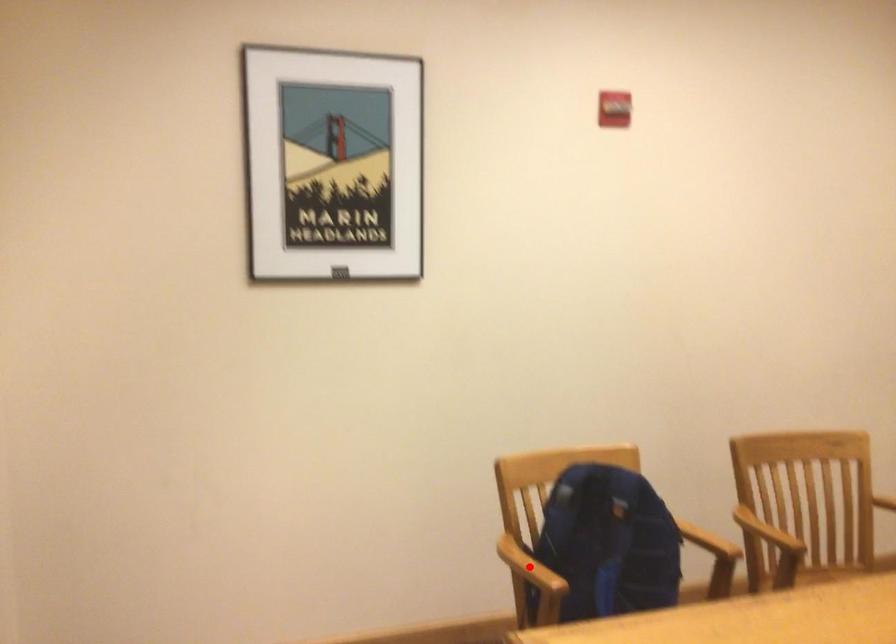
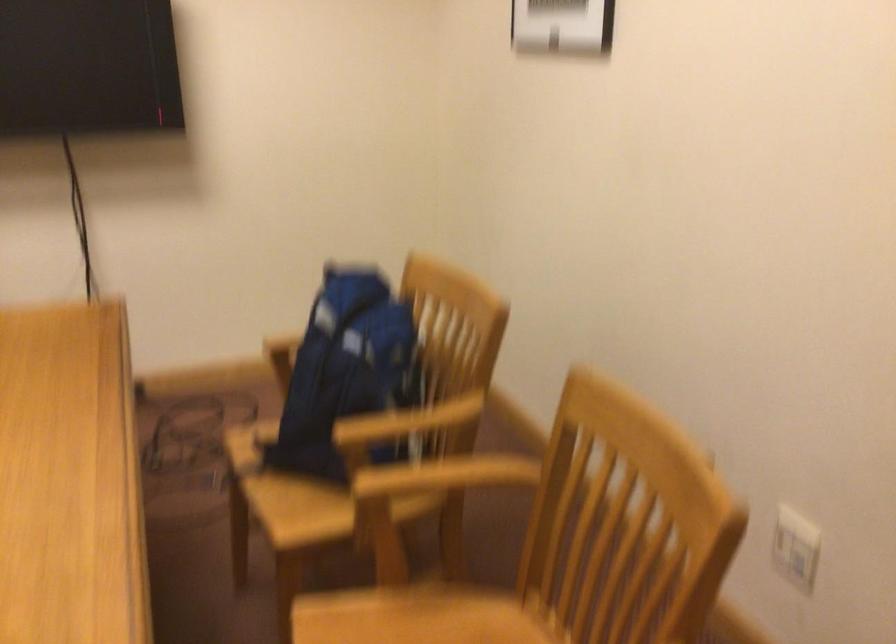
Question: I am providing you with two images of the same scene from different viewpoints. A red point is marked on the first image. Is the red point's position out of view in image 2?

Choices:
 (A) Yes
 (B) No

Answer: (A)